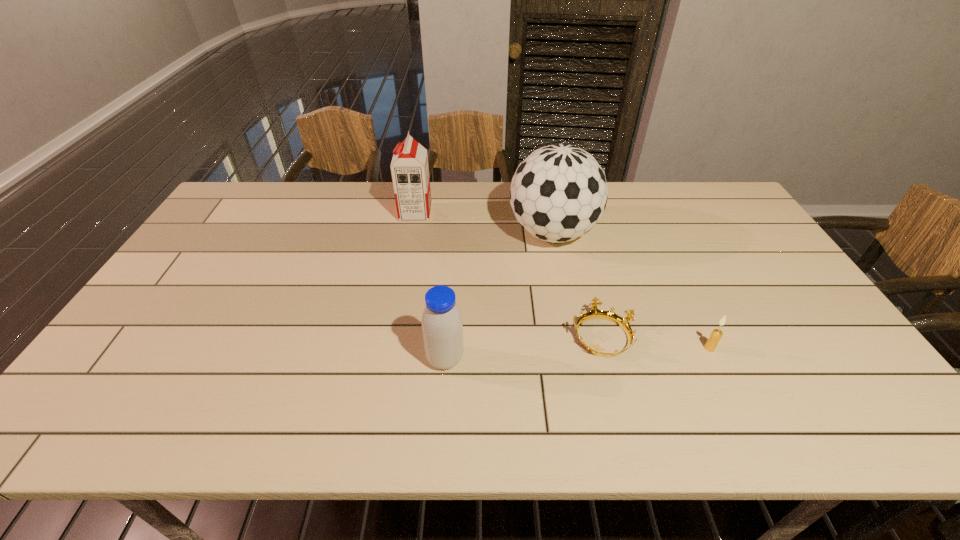
The width and height of the screenshot is (960, 540). Identify the location of soccer ball. (558, 193).

This screenshot has height=540, width=960. What are the coordinates of `the farther soya milk` in the screenshot? It's located at (410, 172).

Identify the location of the leftmost object. (410, 172).

I want to click on the shorter soya milk, so click(x=442, y=327).

Where is `the third tallest object`? the third tallest object is located at coordinates (442, 327).

Locate an element on the screen. This screenshot has width=960, height=540. candle is located at coordinates (711, 344).

Where is `the rightmost object`? The image size is (960, 540). the rightmost object is located at coordinates (711, 344).

You are a GUI agent. You are given a task and a screenshot of the screen. Output one action in this format:
    pyautogui.click(x=<x>, y=<y>)
    Task: Click on the crown
    The width and height of the screenshot is (960, 540).
    Given the screenshot: What is the action you would take?
    pyautogui.click(x=595, y=313)

Locate an element on the screen. free region located 0.370m on the left of the soccer ball is located at coordinates (396, 233).

This screenshot has width=960, height=540. Identify the location of vacant space located on the right of the leftmost object. (526, 213).